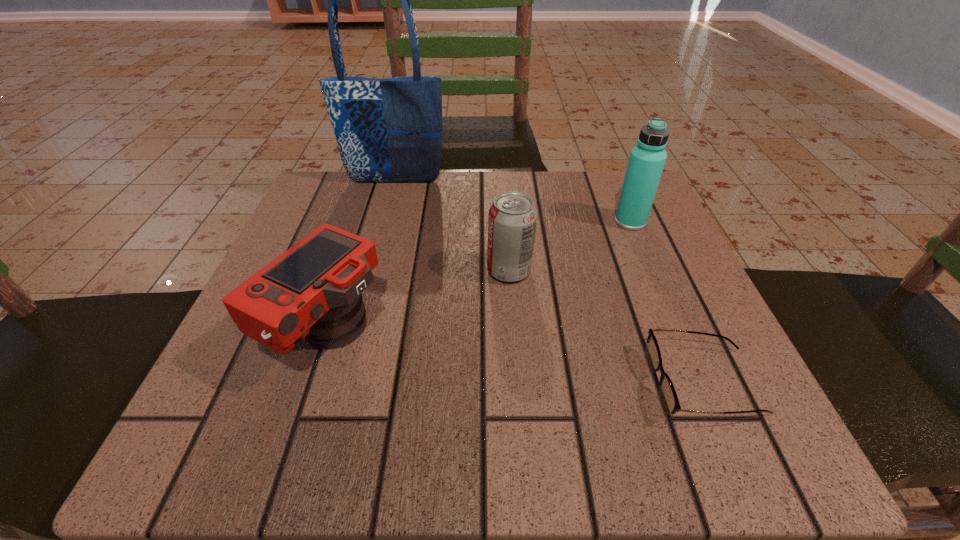
Identify the location of blank area located on the right of the third nearest object. Image resolution: width=960 pixels, height=540 pixels. (615, 271).

Where is `vacant space located on the back of the camera`? The height and width of the screenshot is (540, 960). vacant space located on the back of the camera is located at coordinates (360, 234).

Where is `free space located on the face of the shortest object`? The height and width of the screenshot is (540, 960). free space located on the face of the shortest object is located at coordinates (402, 384).

The image size is (960, 540). I want to click on vacant space located 0.140m on the face of the shortest object, so click(554, 384).

At what (x,y) coordinates should I click in order to perform the action: click on free space located on the face of the shortest object. Please return your answer as a coordinate pair (x, y). This screenshot has height=540, width=960. Looking at the image, I should click on tap(575, 384).

The height and width of the screenshot is (540, 960). In order to click on shopping bag located at the far edge in this screenshot , I will do `click(388, 130)`.

Locate an element on the screen. The image size is (960, 540). thermos bottle that is positioned at the far edge is located at coordinates (647, 159).

At what (x,y) coordinates should I click in order to perform the action: click on object located at the near edge. Please return your answer as a coordinate pair (x, y). The width and height of the screenshot is (960, 540). Looking at the image, I should click on (668, 396).

Where is `shopping bag situated at the left edge`? The image size is (960, 540). shopping bag situated at the left edge is located at coordinates (388, 130).

Find the location of a particular element. Image resolution: width=960 pixels, height=540 pixels. camera located in the left edge section of the desktop is located at coordinates (313, 290).